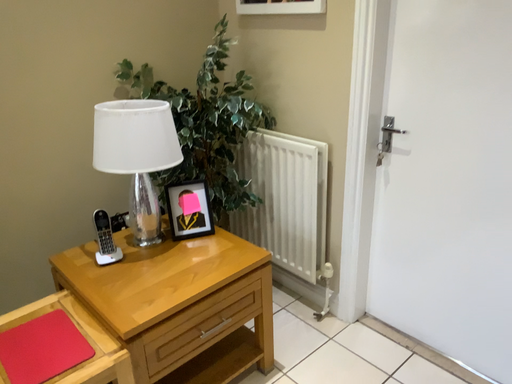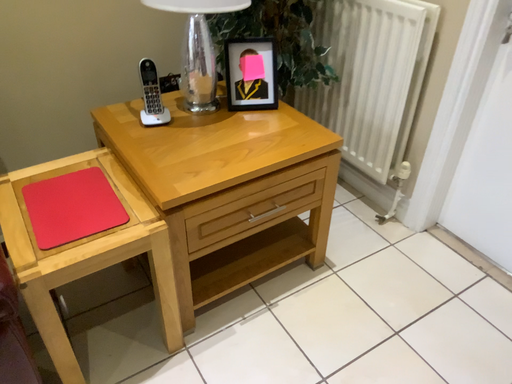
Question: How did the camera likely rotate when shooting the video?

Choices:
 (A) rotated left
 (B) rotated right

Answer: (A)